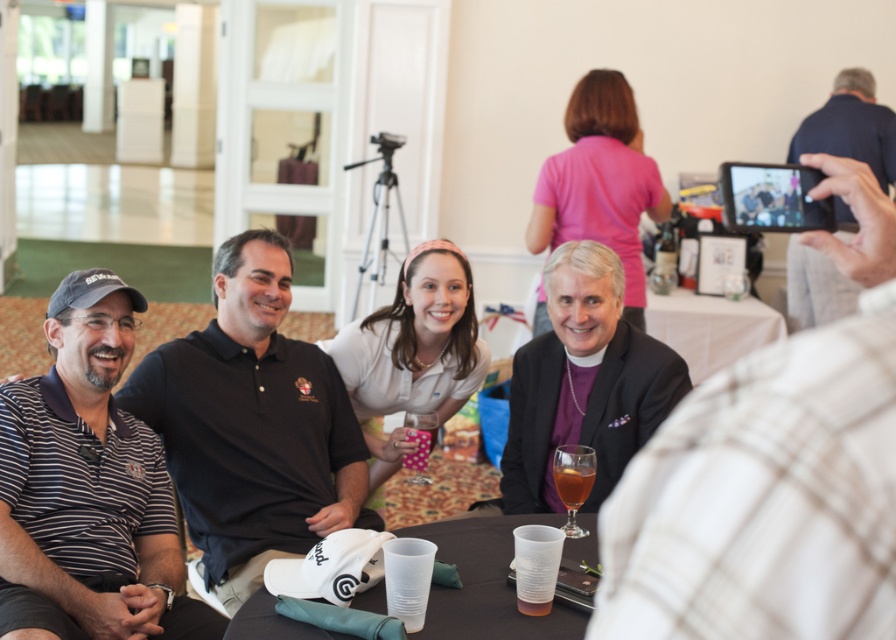
Question: Can you confirm if striped polo shirt at left is positioned to the right of white cloth table at center?

Choices:
 (A) yes
 (B) no

Answer: (B)

Question: In this image, where is purple silk vest at center located relative to dark blue shirt at upper right?

Choices:
 (A) below
 (B) above

Answer: (A)

Question: Estimate the real-world distances between objects in this image. Which object is closer to the purple silk vest at center?

Choices:
 (A) dark blue shirt at upper right
 (B) white plastic cups at lower center
 (C) translucent glass at table center
 (D) translucent plastic cup at table center

Answer: (D)

Question: Which object appears farthest from the camera in this image?

Choices:
 (A) translucent plastic cup at table center
 (B) purple silk vest at center
 (C) dark brown polo shirt at left
 (D) dark blue shirt at upper right

Answer: (D)

Question: Which point appears closest to the camera in this image?

Choices:
 (A) (757, 444)
 (B) (745, 305)

Answer: (A)

Question: Can you confirm if dark brown polo shirt at left is thinner than translucent plastic cup at table center?

Choices:
 (A) no
 (B) yes

Answer: (A)